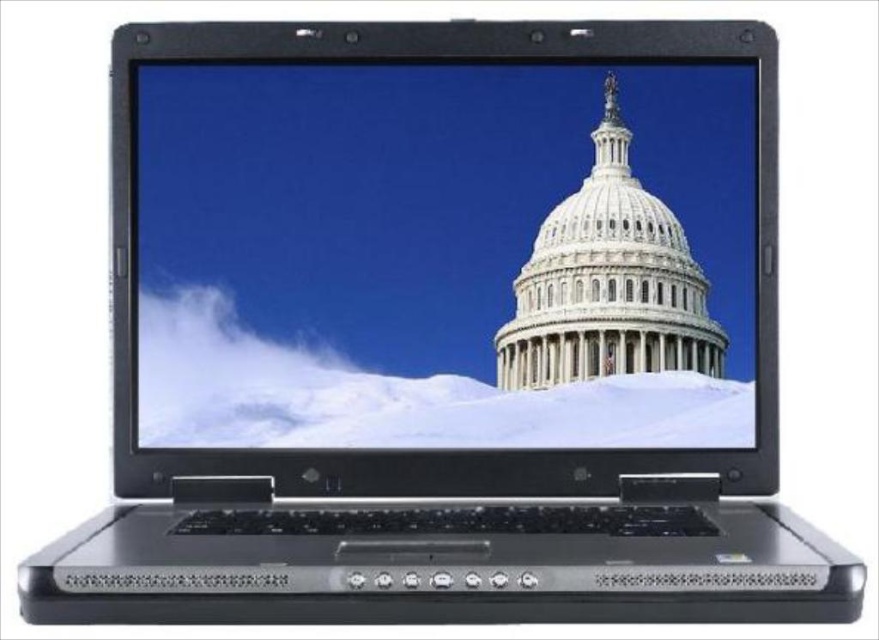
You are an architect examining the laptop screen showing the Capitol building. You notice two domes depicted there. Which dome, the white glossy dome at center or the white marble dome at center, is wider?

The white glossy dome at center is wider than the white marble dome at center.

Based on the scene description, which dome, the white glossy dome at center or the white marble dome at center, appears taller in the image?

The white glossy dome at center appears taller than the white marble dome at center according to the description.

You are looking at the laptop screen showing the Capitol building. Which dome, the white glossy dome at center or the white marble dome at center, appears closer to you?

The white glossy dome at center appears closer because it is in front of the white marble dome at center.